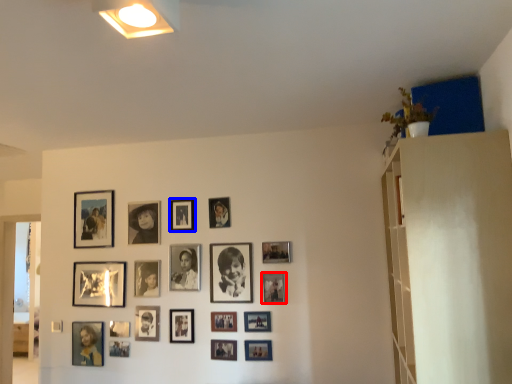
Question: Which object is further to the camera taking this photo, picture frame (highlighted by a red box) or picture frame (highlighted by a blue box)?

Choices:
 (A) picture frame
 (B) picture frame

Answer: (B)